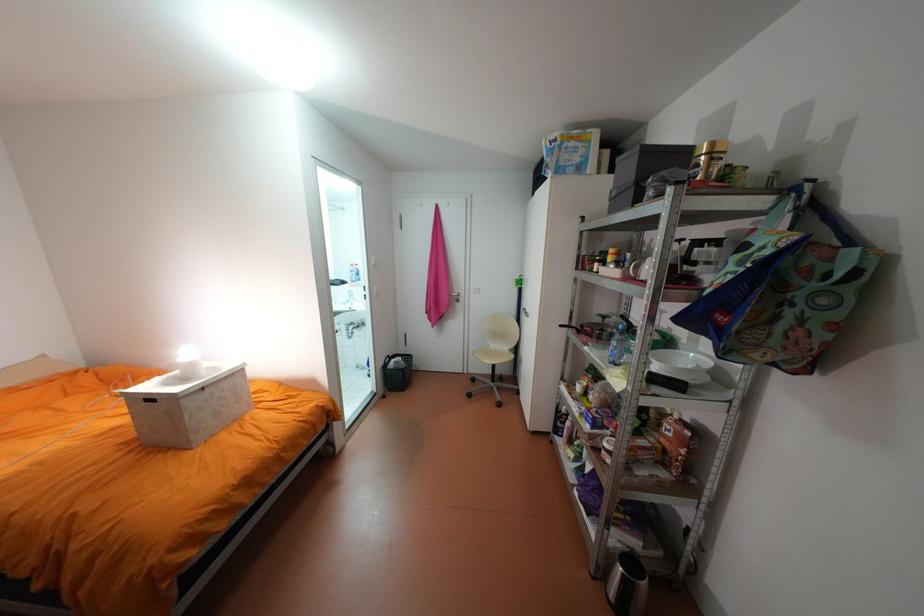
Describe the element at coordinates (144, 399) in the screenshot. The height and width of the screenshot is (616, 924). I see `the white box handle` at that location.